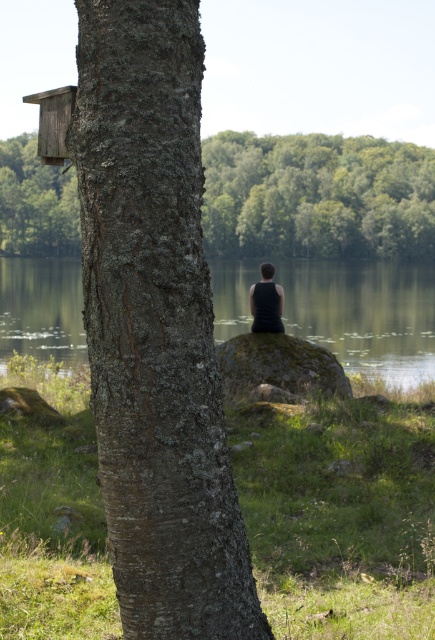
Question: Which of the following is the closest to the observer?

Choices:
 (A) smooth bark tree trunk at left
 (B) green water at center
 (C) green mossy rock at center
 (D) wooden bird feeder at upper left

Answer: (A)

Question: Is smooth bark tree trunk at center wider than green water at center?

Choices:
 (A) no
 (B) yes

Answer: (A)

Question: Does smooth bark tree trunk at center have a larger size compared to black matte tank top at center?

Choices:
 (A) yes
 (B) no

Answer: (A)

Question: Does smooth bark tree trunk at left have a smaller size compared to green mossy rock at center?

Choices:
 (A) yes
 (B) no

Answer: (B)

Question: Which of the following is the closest to the observer?

Choices:
 (A) green mossy rock at center
 (B) smooth bark tree trunk at center
 (C) wooden bird feeder at upper left

Answer: (B)

Question: Which of the following is the farthest from the observer?

Choices:
 (A) (177, 557)
 (B) (381, 198)
 (C) (293, 305)
 (D) (313, 380)

Answer: (B)